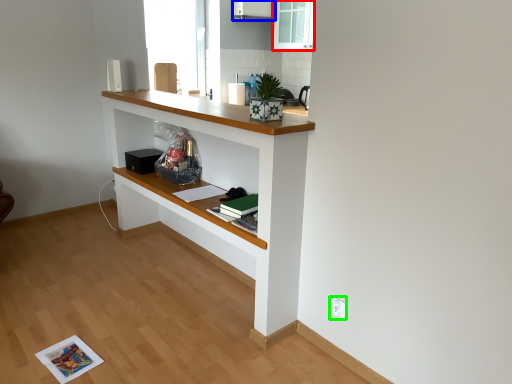
Question: Which object is the farthest from glass door (highlighted by a red box)? Choose among these: cabinetry (highlighted by a blue box) or electric outlet (highlighted by a green box).

Choices:
 (A) cabinetry
 (B) electric outlet

Answer: (B)